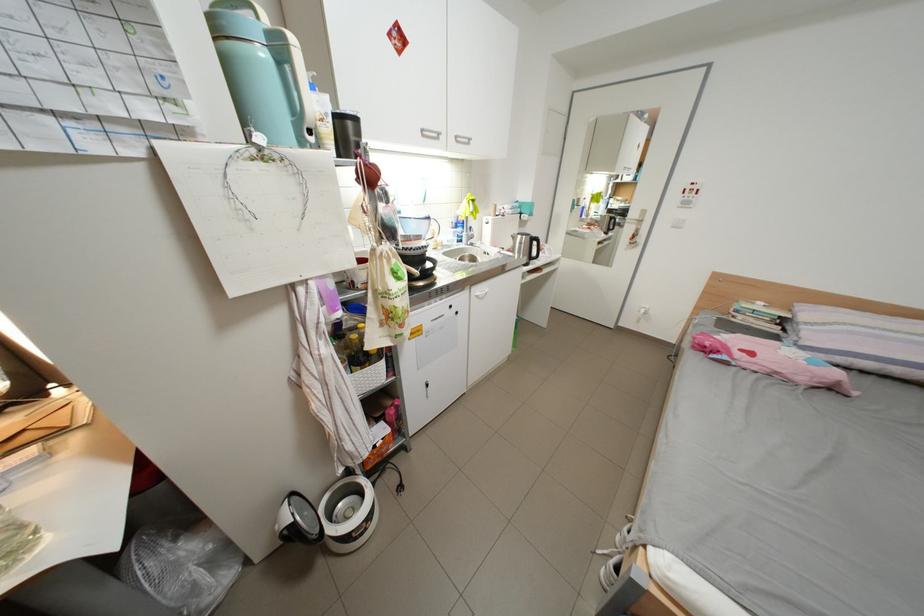
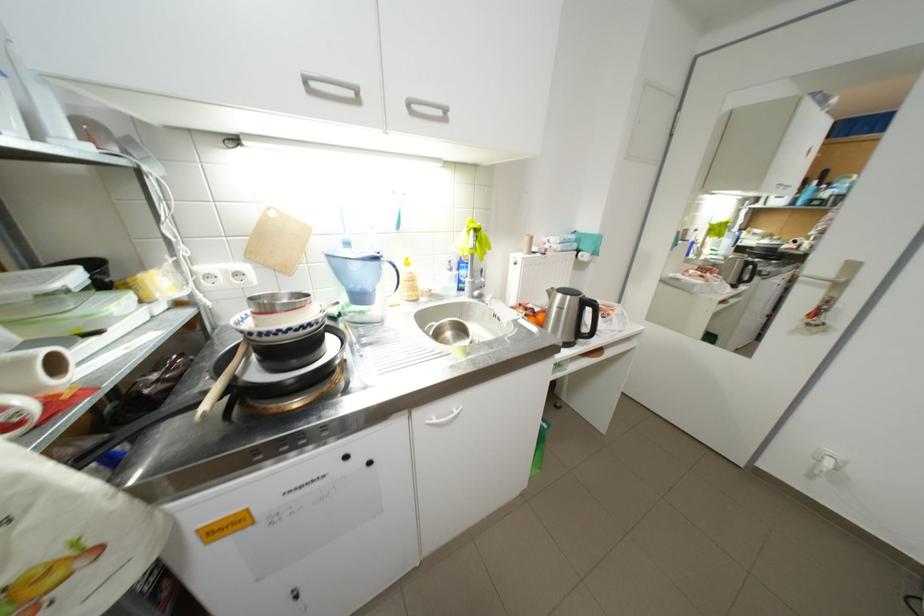
The point at (440, 219) is marked in the first image. Where is the corresponding point in the second image?

(387, 259)